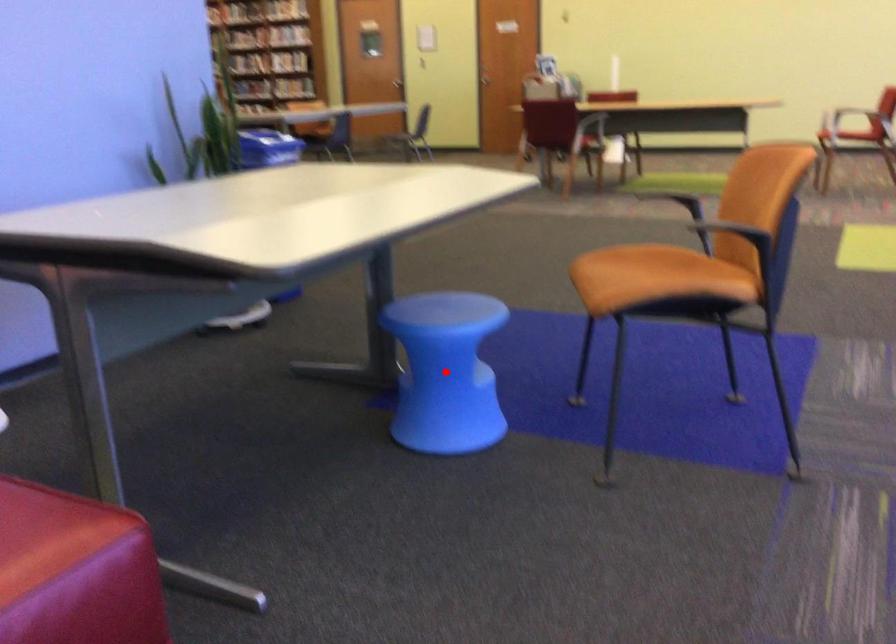
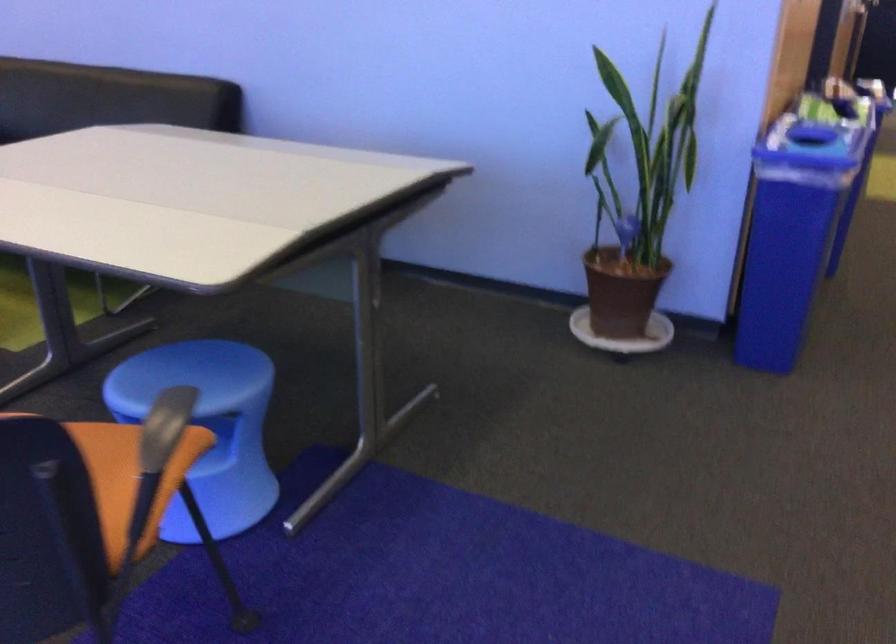
Question: I am providing you with two images of the same scene from different viewpoints. A red point is marked on the first image. Can you still see the location of the red point in image 2?

Choices:
 (A) Yes
 (B) No

Answer: (B)